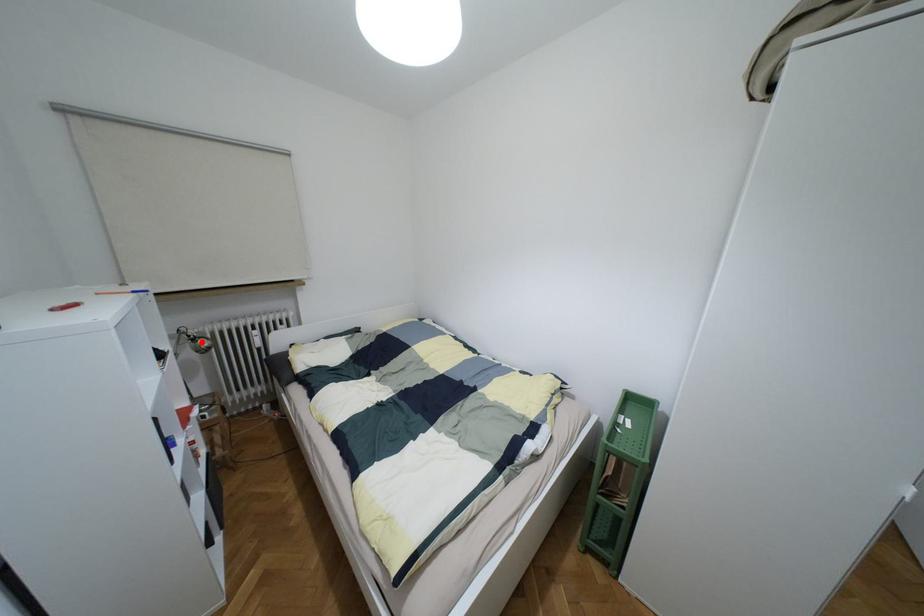
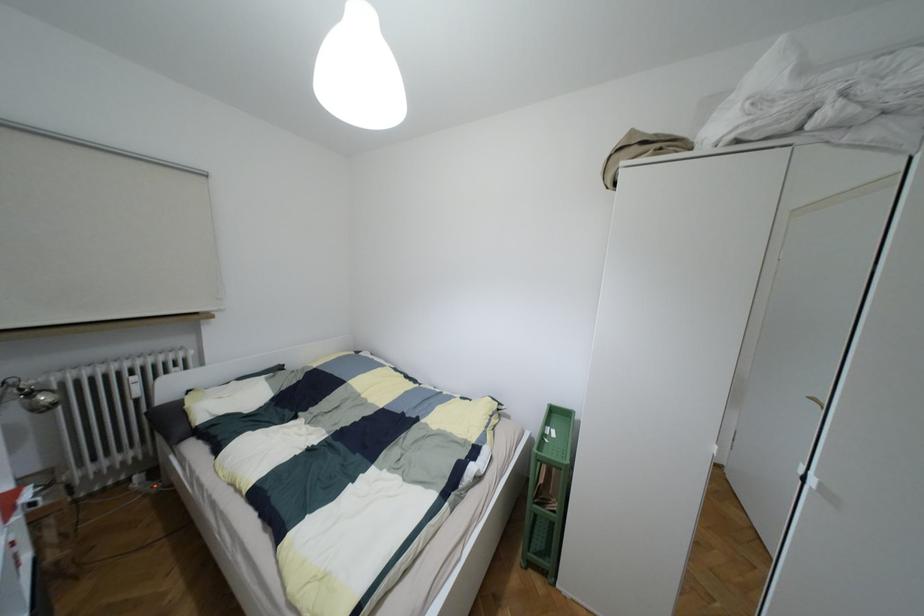
In the second image, find the point that corresponds to the highlighted location in the first image.

(43, 397)